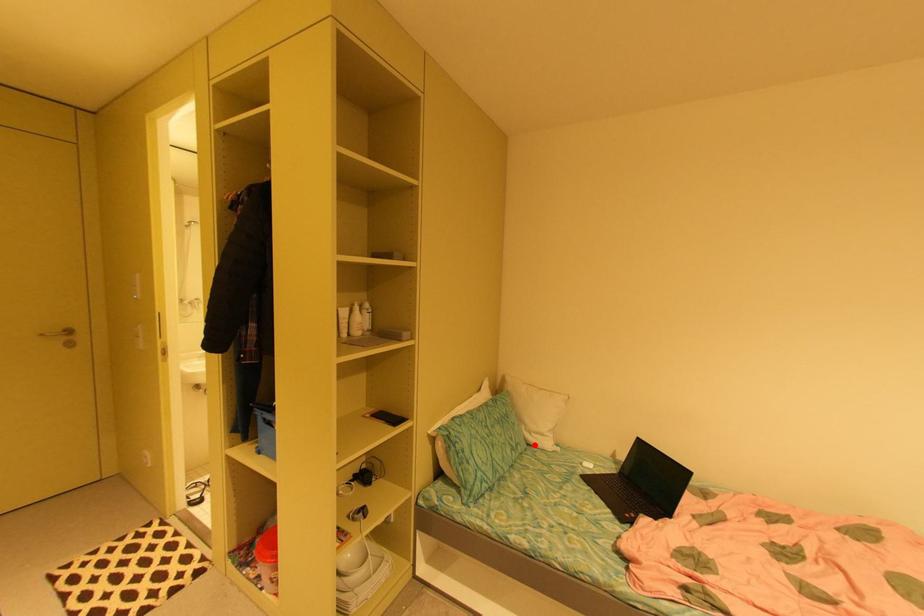
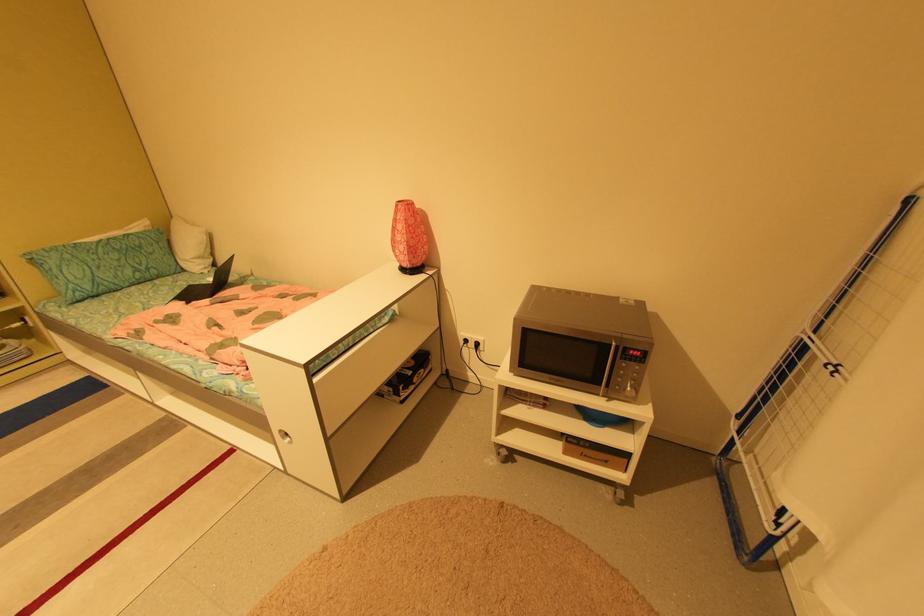
Question: I am providing you with two images of the same scene from different viewpoints. Image1 has a red point marked. In image2, the corresponding 3D location appears at what relative position? Reply with the corresponding letter.

Choices:
 (A) Closer
 (B) Farther

Answer: (A)